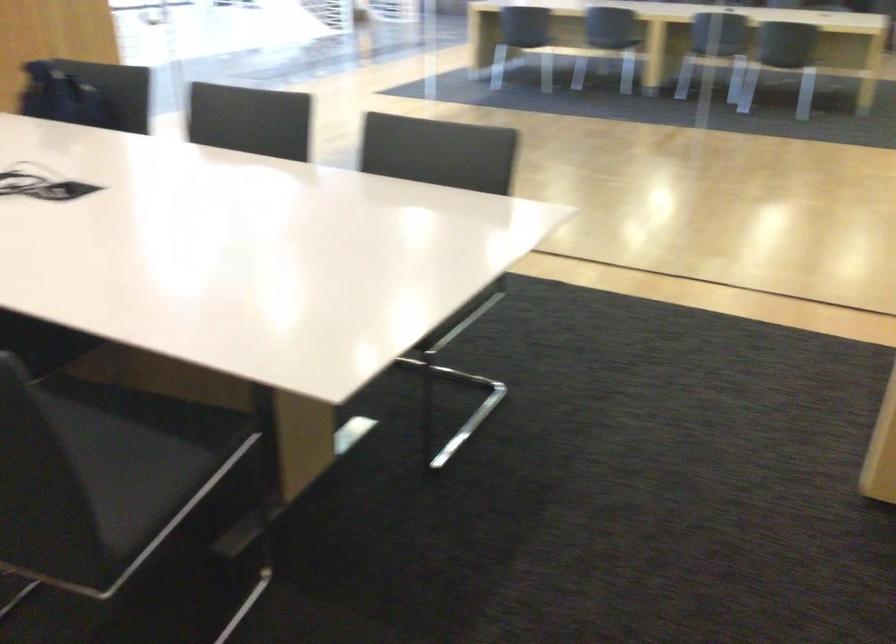
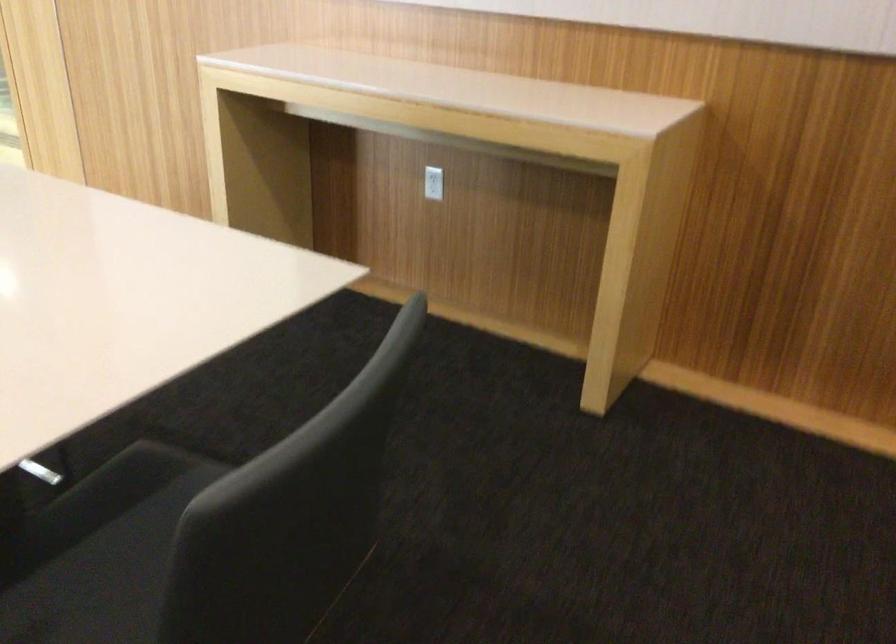
The point at [104,428] is marked in the first image. Where is the corresponding point in the second image?

(101, 551)